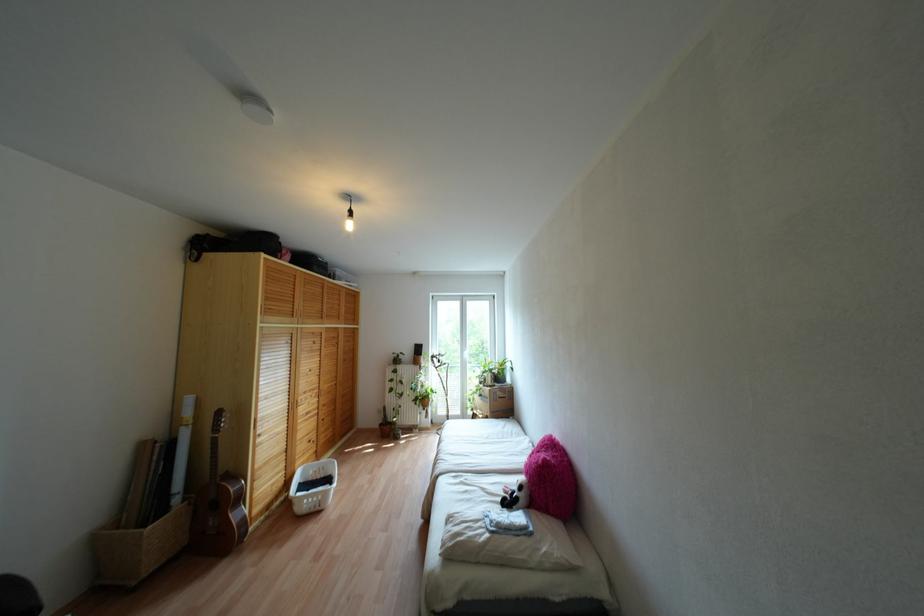
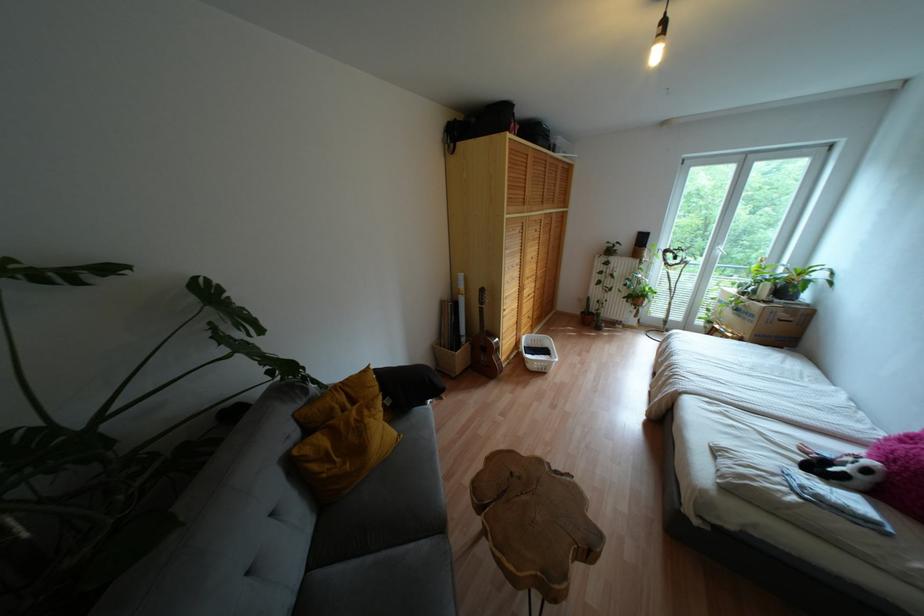
Locate, in the second image, the point that corresponds to pixel 317 508 in the first image.

(542, 370)